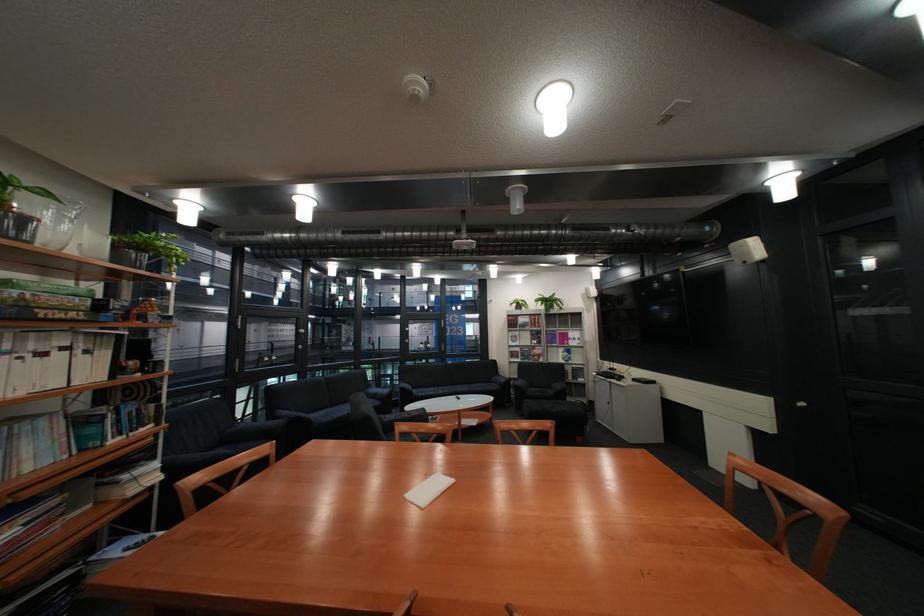
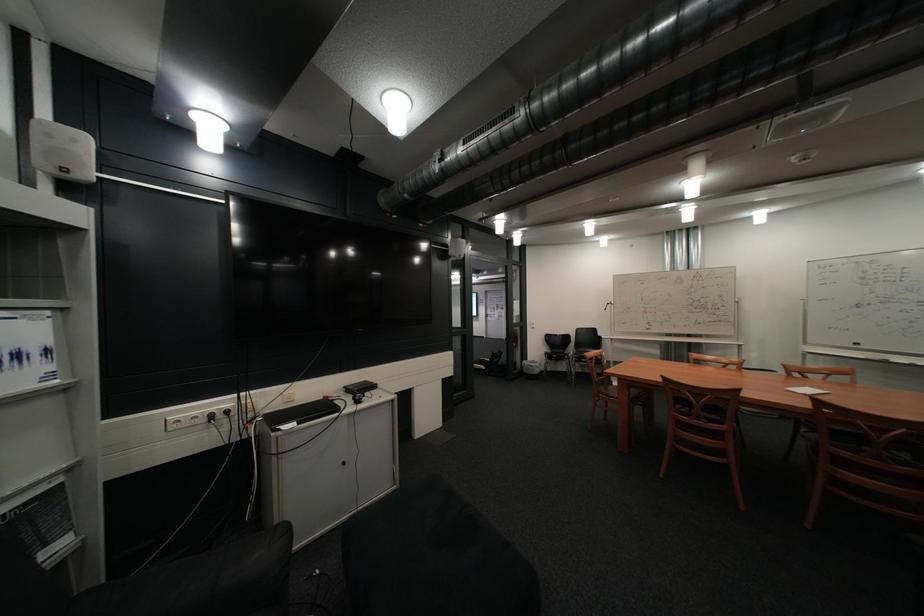
In the second image, find the point that corresponds to (590,345) in the first image.

(46, 386)